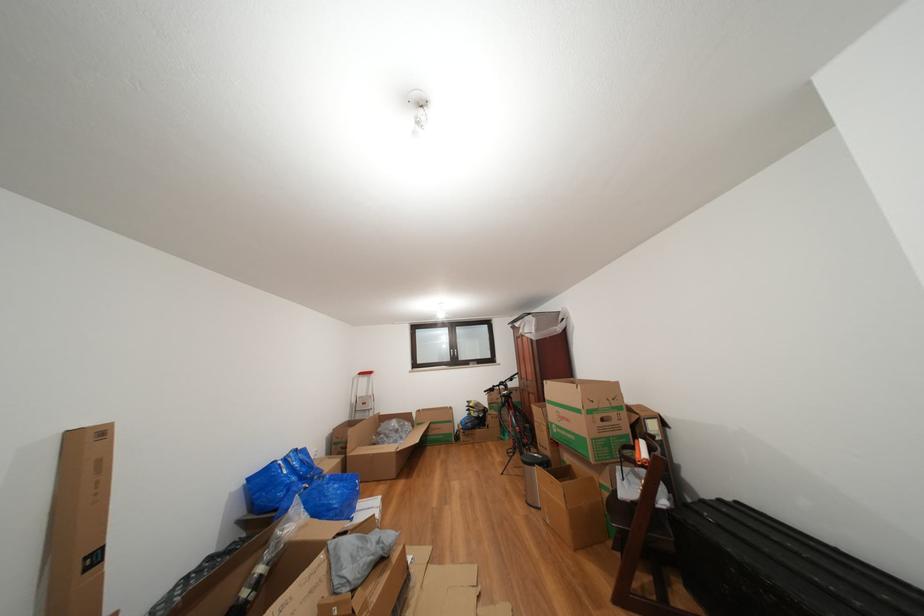
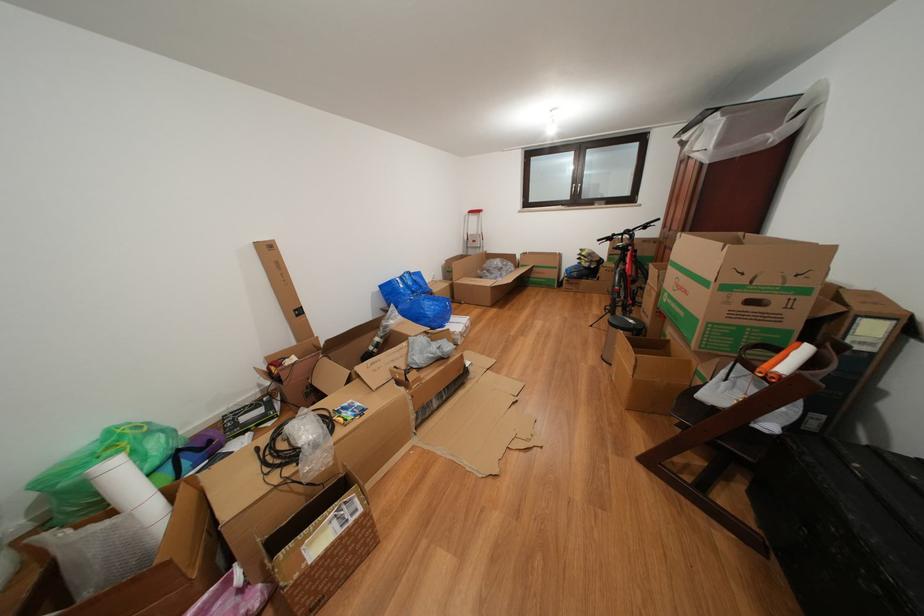
Find the pixel in the second image that matches (x=411, y=440) in the first image.

(513, 280)